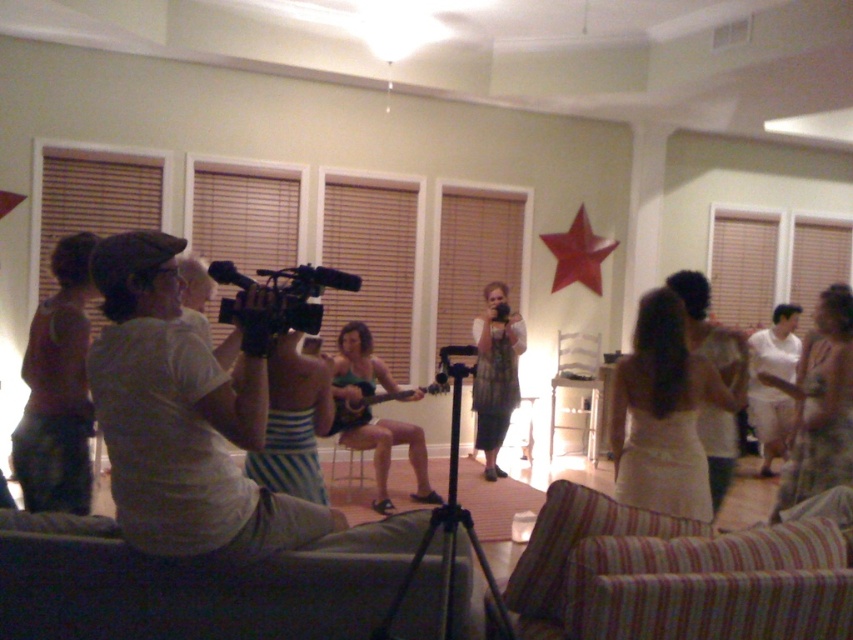
Does patterned fabric dress at center appear on the right side of black plastic video camera at center?

Correct, you'll find patterned fabric dress at center to the right of black plastic video camera at center.

The image size is (853, 640). What do you see at coordinates (821, 406) in the screenshot?
I see `patterned fabric dress at center` at bounding box center [821, 406].

Identify the location of patterned fabric dress at center. The width and height of the screenshot is (853, 640). (821, 406).

Locate an element on the screen. This screenshot has width=853, height=640. patterned fabric dress at center is located at coordinates (821, 406).

Which is behind, point (77, 509) or point (502, 440)?

The point (502, 440) is more distant.

How much distance is there between matte brown shirt at left and metallic silver dress at center?

matte brown shirt at left is 11.42 feet away from metallic silver dress at center.

Locate an element on the screen. This screenshot has width=853, height=640. matte brown shirt at left is located at coordinates (57, 388).

Identify the location of matte brown shirt at left. The height and width of the screenshot is (640, 853). (57, 388).

The height and width of the screenshot is (640, 853). Describe the element at coordinates (821, 406) in the screenshot. I see `patterned fabric dress at center` at that location.

Locate an element on the screen. patterned fabric dress at center is located at coordinates (821, 406).